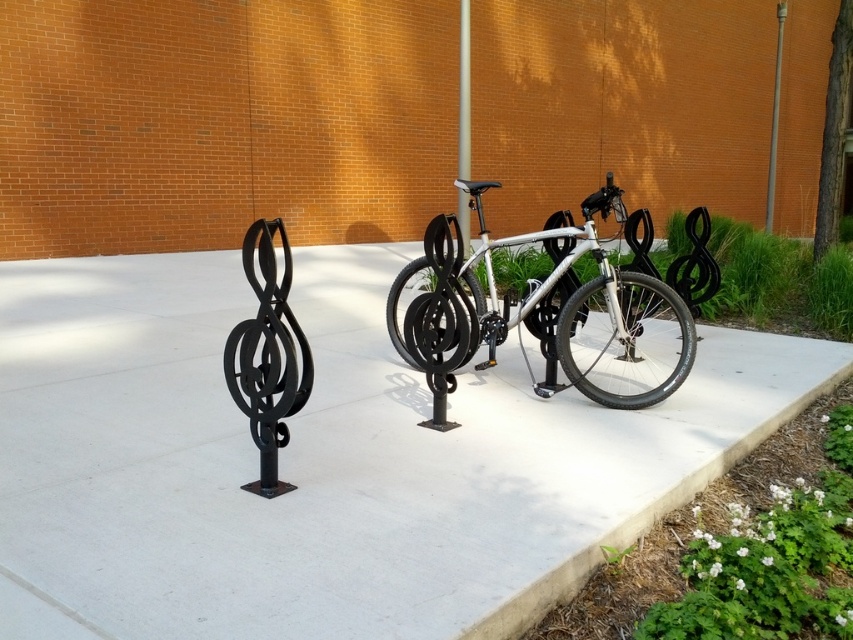
Question: From the image, what is the correct spatial relationship of white concrete pavement at center in relation to black wrought iron treble clef at left?

Choices:
 (A) below
 (B) above

Answer: (A)

Question: Which point appears closest to the camera in this image?

Choices:
 (A) (154, 356)
 (B) (468, 92)
 (C) (778, 51)
 (D) (643, 362)

Answer: (A)

Question: Is white concrete pavement at center wider than black wrought iron treble clef at left?

Choices:
 (A) yes
 (B) no

Answer: (A)

Question: Can you confirm if silver metallic bicycle at center is positioned to the left of gray metallic pole at upper right?

Choices:
 (A) yes
 (B) no

Answer: (A)

Question: Which point appears farthest from the camera in this image?

Choices:
 (A) (613, 273)
 (B) (467, 195)
 (C) (207, 380)

Answer: (B)

Question: Which object is positioned closest to the silver metallic pole at center?

Choices:
 (A) gray metallic pole at upper right
 (B) black wrought iron treble clef at left
 (C) white concrete pavement at center

Answer: (C)